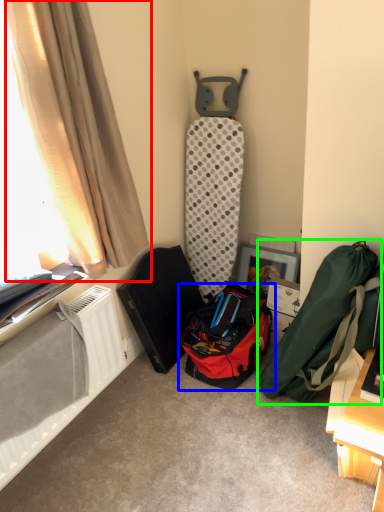
Question: Based on their relative distances, which object is farther from curtain (highlighted by a red box)? Choose from luggage and bags (highlighted by a blue box) and luggage and bags (highlighted by a green box).

Choices:
 (A) luggage and bags
 (B) luggage and bags

Answer: (B)